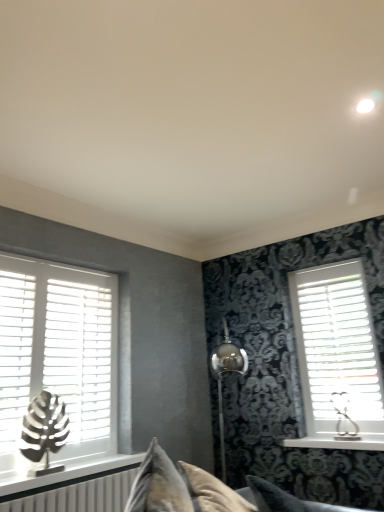
Question: Considering the relative sizes of velvet gray pillow at lower center and velvet beige couch at center in the image provided, is velvet gray pillow at lower center wider than velvet beige couch at center?

Choices:
 (A) no
 (B) yes

Answer: (A)

Question: Are velvet gray pillow at lower center and velvet beige couch at center far apart?

Choices:
 (A) yes
 (B) no

Answer: (B)

Question: Is velvet beige couch at center inside velvet gray pillow at lower center?

Choices:
 (A) yes
 (B) no

Answer: (B)

Question: From the image's perspective, would you say velvet gray pillow at lower center is positioned over velvet beige couch at center?

Choices:
 (A) yes
 (B) no

Answer: (B)

Question: Considering the relative positions of velvet gray pillow at lower center and velvet beige couch at center in the image provided, is velvet gray pillow at lower center to the left of velvet beige couch at center from the viewer's perspective?

Choices:
 (A) no
 (B) yes

Answer: (A)

Question: Is white matte shutter at left to the left or to the right of metallic leaf sculpture at left, the 1th table lamp in the front-to-back sequence, in the image?

Choices:
 (A) left
 (B) right

Answer: (A)

Question: From a real-world perspective, is white matte shutter at left positioned above or below metallic leaf sculpture at left, positioned as the first table lamp in left-to-right order?

Choices:
 (A) above
 (B) below

Answer: (A)

Question: Based on their sizes in the image, would you say white matte shutter at left is bigger or smaller than metallic leaf sculpture at left, the 1th table lamp in the front-to-back sequence?

Choices:
 (A) big
 (B) small

Answer: (A)

Question: Considering their positions, is white matte shutter at left located in front of or behind metallic leaf sculpture at left, marked as the second table lamp in a back-to-front arrangement?

Choices:
 (A) front
 (B) behind

Answer: (B)

Question: Considering the positions of point (28, 258) and point (273, 501), is point (28, 258) closer or farther from the camera than point (273, 501)?

Choices:
 (A) farther
 (B) closer

Answer: (A)

Question: In the image, is white wood blinds at left, which appears as the 2th window when viewed from the right, on the left side or the right side of velvet gray pillow at lower center?

Choices:
 (A) right
 (B) left

Answer: (B)

Question: Do you think white wood blinds at left, which appears as the 1th window when viewed from the left, is within velvet gray pillow at lower center, or outside of it?

Choices:
 (A) inside
 (B) outside

Answer: (B)

Question: Is white wood blinds at left, which appears as the 2th window when viewed from the right, in front of or behind velvet gray pillow at lower center in the image?

Choices:
 (A) behind
 (B) front

Answer: (A)

Question: Based on their positions, is metallic silver table lamp at right, which ranks as the first table lamp in right-to-left order, located to the left or right of white wood blinds at left, which appears as the 2th window when viewed from the right?

Choices:
 (A) left
 (B) right

Answer: (B)

Question: Looking at the image, does metallic silver table lamp at right, which ranks as the first table lamp in right-to-left order, seem bigger or smaller compared to white wood blinds at left, which appears as the 2th window when viewed from the right?

Choices:
 (A) small
 (B) big

Answer: (A)